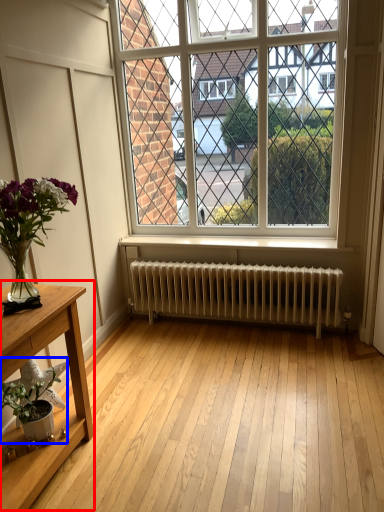
Question: Which object is further to the camera taking this photo, table (highlighted by a red box) or houseplant (highlighted by a blue box)?

Choices:
 (A) table
 (B) houseplant

Answer: (B)